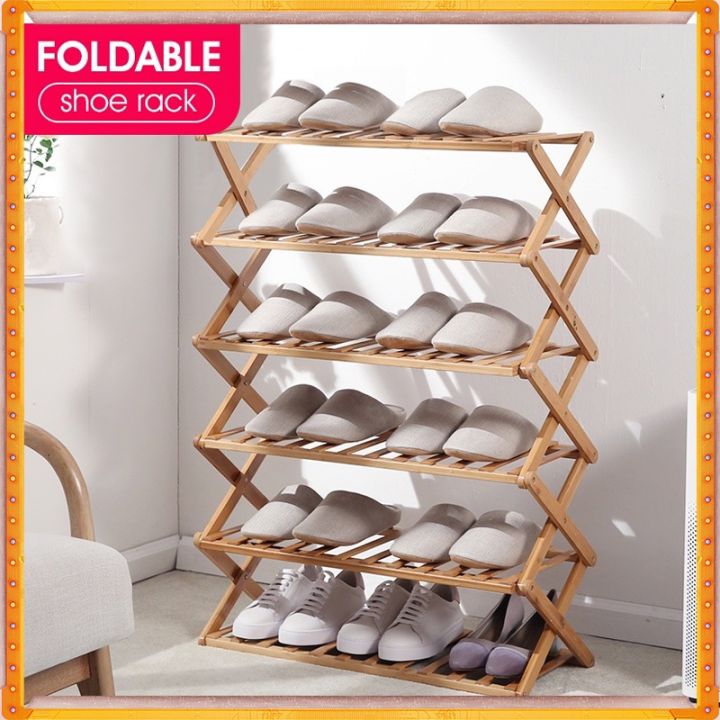
Where is `bottom row of shoes`? This screenshot has width=720, height=720. bottom row of shoes is located at coordinates (264, 600), (312, 613), (368, 608), (436, 616), (490, 630), (508, 641).